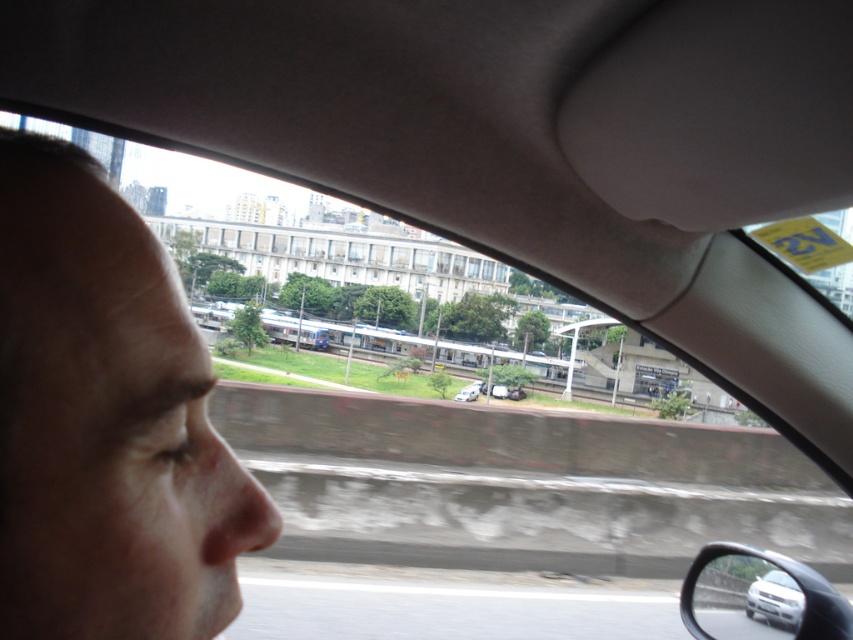
You are a passenger in the car and want to check the blind spot before changing lanes. Which object, the silver metallic side mirror at lower right or the silver metallic car at lower right, would allow you to see further behind the car?

The silver metallic side mirror at lower right has a greater height compared to the silver metallic car at lower right, so it would provide a better view to check the blind spot further behind the car.

You are sitting in the driver seat of the car and want to know which point is closer to you between point (770, 618) and point (474, 394). Can you tell me which one?

Result: Point (770, 618) is closer to the viewer than point (474, 394).